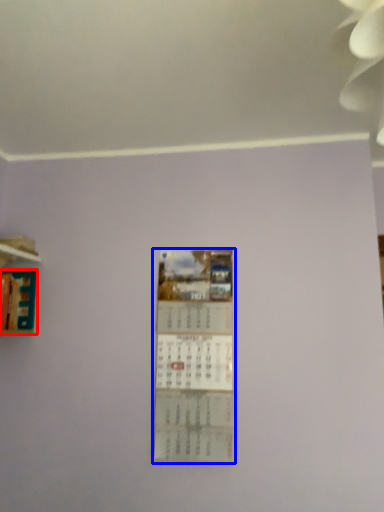
Question: Which point is further to the camera, book (highlighted by a red box) or poster (highlighted by a blue box)?

Choices:
 (A) book
 (B) poster

Answer: (B)